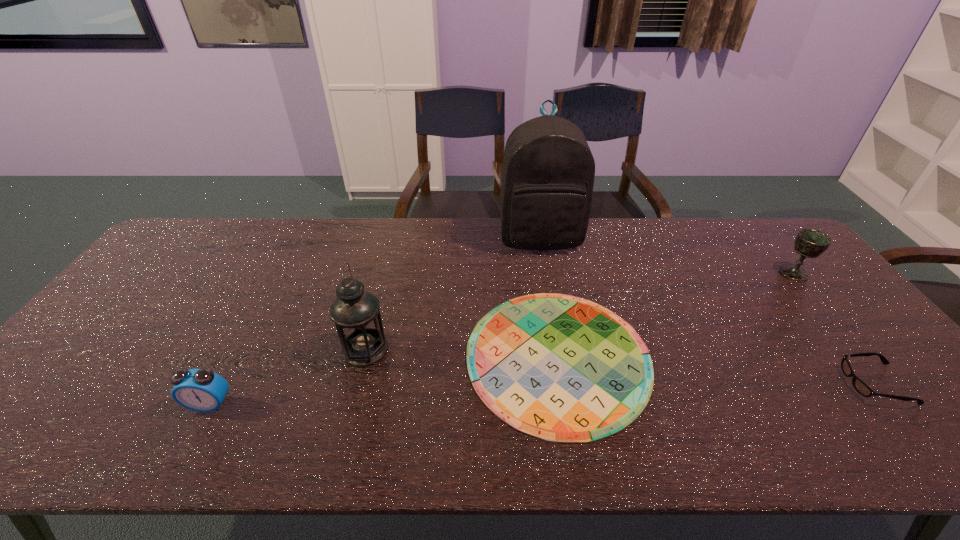
The image size is (960, 540). I want to click on vacant space located on the front-facing side of the backpack, so click(x=559, y=347).

Where is `vacant position located 0.110m on the back of the oil lamp`? The width and height of the screenshot is (960, 540). vacant position located 0.110m on the back of the oil lamp is located at coordinates (376, 303).

Identify the location of free point located 0.060m on the left of the fourth shortest object. The height and width of the screenshot is (540, 960). (760, 273).

What are the coordinates of `free space located 0.070m on the face of the leftmost object` in the screenshot? It's located at (190, 442).

Find the location of a particular element. The image size is (960, 540). free space located 0.160m on the front-facing side of the second shortest object is located at coordinates (779, 383).

I want to click on free space located on the front-facing side of the second shortest object, so click(x=695, y=383).

The image size is (960, 540). In order to click on free space located on the front-facing side of the second shortest object in this screenshot , I will do `click(800, 383)`.

Locate an element on the screen. vacant region located 0.260m on the right of the gameboard is located at coordinates (754, 357).

This screenshot has width=960, height=540. In order to click on object present at the far edge in this screenshot , I will do `click(548, 172)`.

You are a GUI agent. You are given a task and a screenshot of the screen. Output one action in this format:
    pyautogui.click(x=<x>, y=<y>)
    Task: Click on the object present at the near edge
    
    Given the screenshot: What is the action you would take?
    pyautogui.click(x=561, y=368)